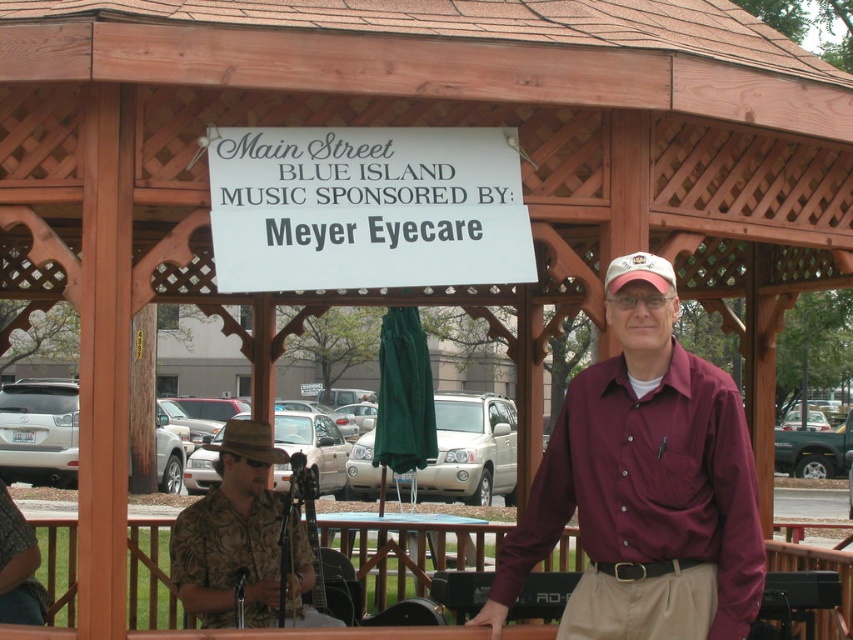
Between point (239, 147) and point (668, 291), which one is positioned behind?

The point (239, 147) is more distant.

The image size is (853, 640). In order to click on white paper sign at center in this screenshot , I will do `click(366, 209)`.

Who is positioned more to the left, brown fabric baseball hat at center or white fabric baseball cap at upper center?

brown fabric baseball hat at center

Between brown fabric baseball hat at center and white fabric baseball cap at upper center, which one is positioned higher?

white fabric baseball cap at upper center is higher up.

Between point (231, 417) and point (637, 278), which one is positioned behind?

Point (231, 417)

This screenshot has height=640, width=853. Find the location of `brown fabric baseball hat at center`. brown fabric baseball hat at center is located at coordinates (247, 442).

Does camouflage shirt at center appear over white fabric baseball cap at upper center?

No, camouflage shirt at center is not above white fabric baseball cap at upper center.

Describe the element at coordinates (231, 532) in the screenshot. I see `camouflage shirt at center` at that location.

Where is `camouflage shirt at center`? This screenshot has width=853, height=640. camouflage shirt at center is located at coordinates (231, 532).